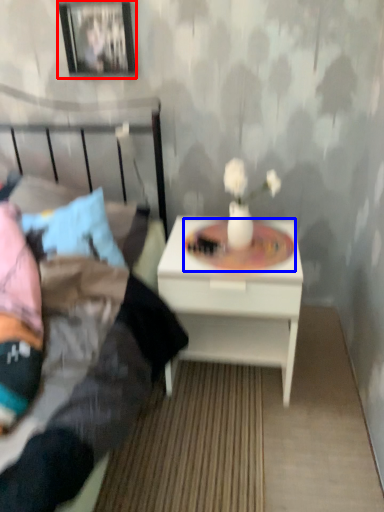
Question: Which object is further to the camera taking this photo, picture frame (highlighted by a red box) or round table (highlighted by a blue box)?

Choices:
 (A) picture frame
 (B) round table

Answer: (A)